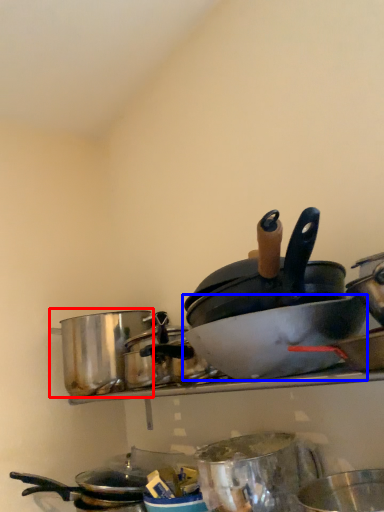
Question: Which object is closer to the camera taking this photo, crock pot (highlighted by a red box) or basin (highlighted by a blue box)?

Choices:
 (A) crock pot
 (B) basin

Answer: (B)